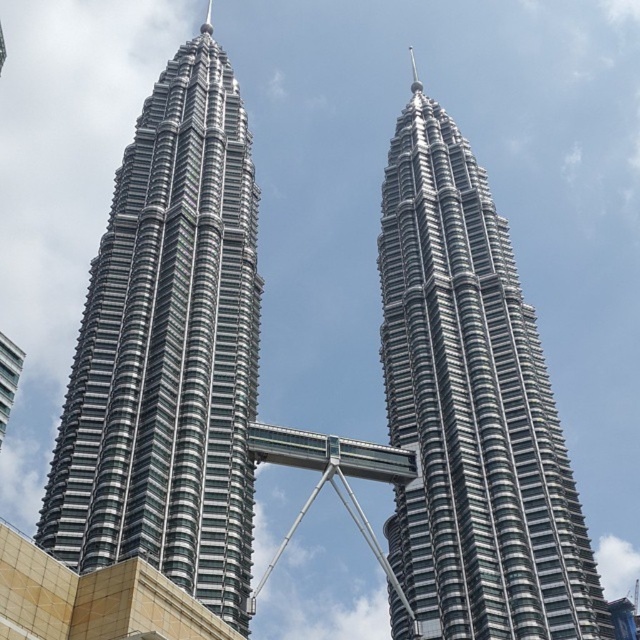
Which is in front, point (227, 100) or point (449, 244)?

Positioned in front is point (449, 244).

Who is more forward, (138,205) or (611,624)?

Point (611,624) is in front.

Locate an element on the screen. This screenshot has width=640, height=640. silver glass skyscraper at center is located at coordinates (168, 349).